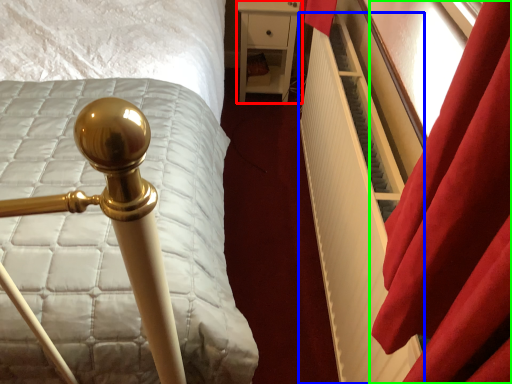
Question: Which object is positioned farthest from furniture (highlighted by a red box)? Select from radiator (highlighted by a blue box) and curtain (highlighted by a green box).

Choices:
 (A) radiator
 (B) curtain

Answer: (B)